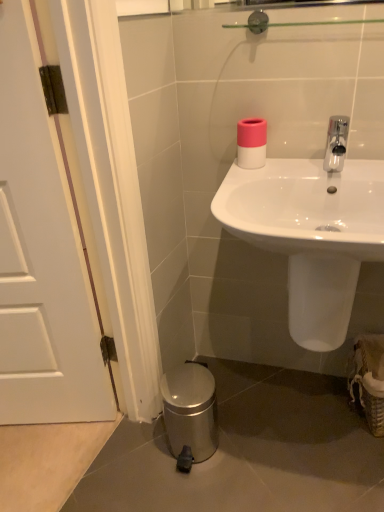
At what (x,y) coordinates should I click in order to perform the action: click on vacant area situated below white glossy sink at center (from a real-world perspective). Please return your answer as a coordinate pair (x, y). Image resolution: width=384 pixels, height=512 pixels. Looking at the image, I should click on (299, 421).